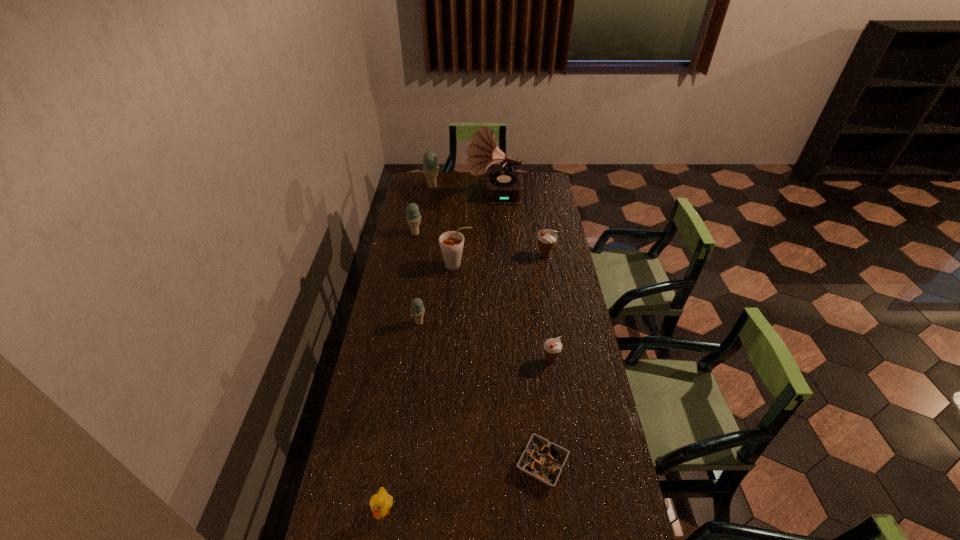
The image size is (960, 540). Find the location of `record player`. record player is located at coordinates (504, 187).

You are a GUI agent. You are given a task and a screenshot of the screen. Output one action in this format:
    pyautogui.click(x=<x>, y=<y>)
    Task: Click on the tallest object
    
    Given the screenshot: What is the action you would take?
    pyautogui.click(x=504, y=187)

Find the location of a particular element. The height and width of the screenshot is (540, 960). the tallest ice cream is located at coordinates pos(430,168).

Where is `the biggest blue ice cream`? the biggest blue ice cream is located at coordinates (430, 168).

Locate an element on the screen. The image size is (960, 540). root beer is located at coordinates (451, 243).

At what (x,y) coordinates should I click in order to perform the action: click on the farther white icecream. Please return your answer as a coordinate pair (x, y). The width and height of the screenshot is (960, 540). Looking at the image, I should click on (547, 239).

Locate an element on the screen. The height and width of the screenshot is (540, 960). the third farthest ice cream is located at coordinates [x=547, y=239].

I want to click on the second farthest blue ice cream, so click(413, 217).

Identify the location of the fourth nearest ice cream. The image size is (960, 540). [x=413, y=217].

Find the location of a particular element. the nearest ice cream is located at coordinates [x=552, y=347].